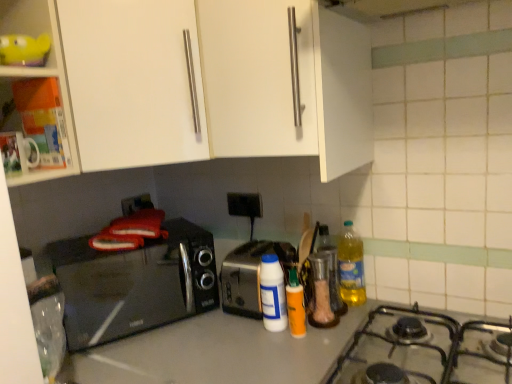
This screenshot has height=384, width=512. I want to click on blank area to the left of clear glass container at center, so click(x=260, y=333).